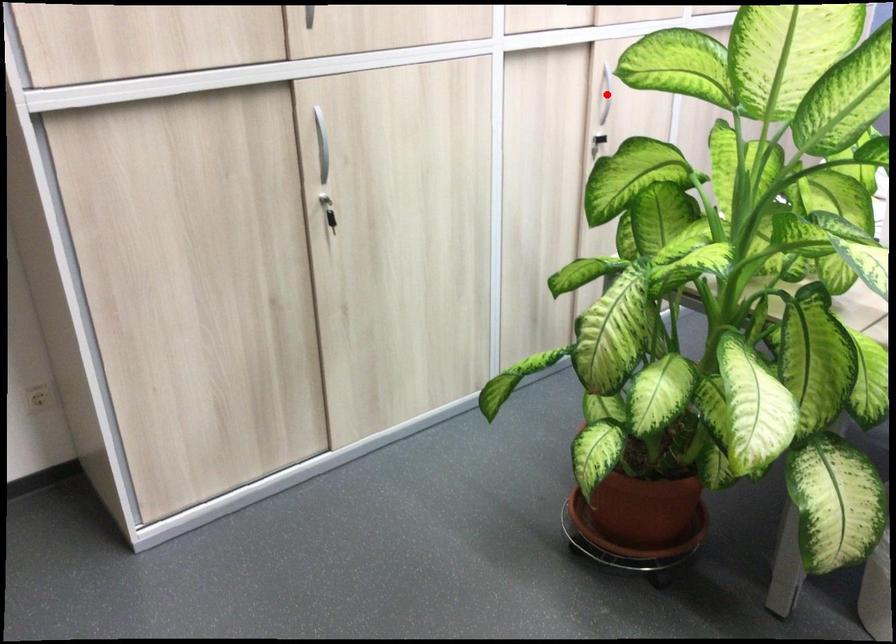
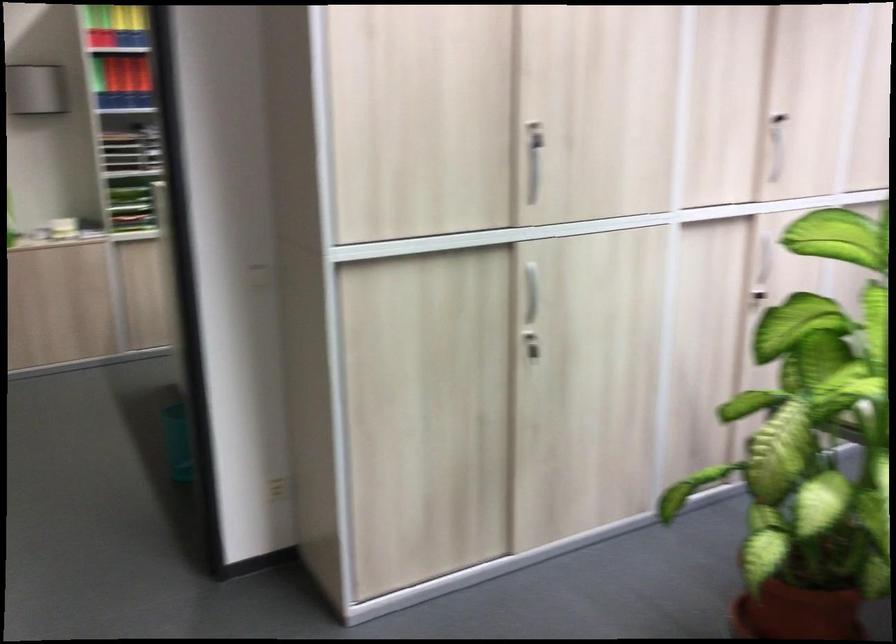
Locate, in the second image, the point that corresponds to the highlighted location in the first image.

(764, 257)